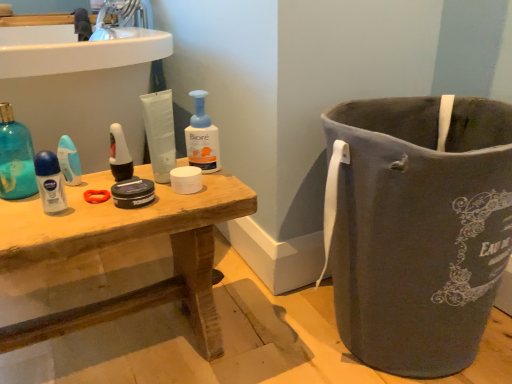
Question: Considering the relative positions of matte white shaving cream at left and translucent plastic deodorant stick at left, which ranks as the 2th cleaning product in right-to-left order, in the image provided, is matte white shaving cream at left to the left of translucent plastic deodorant stick at left, which ranks as the 2th cleaning product in right-to-left order, from the viewer's perspective?

Choices:
 (A) yes
 (B) no

Answer: (B)

Question: Is matte white shaving cream at left facing away from translucent plastic deodorant stick at left, which ranks as the 2th cleaning product in right-to-left order?

Choices:
 (A) no
 (B) yes

Answer: (A)

Question: From the image's perspective, is matte white shaving cream at left on top of translucent plastic deodorant stick at left, which ranks as the 1th cleaning product in left-to-right order?

Choices:
 (A) no
 (B) yes

Answer: (A)

Question: Is translucent plastic deodorant stick at left, which ranks as the 1th cleaning product in left-to-right order, inside matte white shaving cream at left?

Choices:
 (A) no
 (B) yes

Answer: (A)

Question: Is matte white shaving cream at left bigger than translucent plastic deodorant stick at left, which ranks as the 1th cleaning product in left-to-right order?

Choices:
 (A) yes
 (B) no

Answer: (B)

Question: Considering the relative positions of matte white shaving cream at left and translucent plastic deodorant stick at left, which ranks as the 2th cleaning product in right-to-left order, in the image provided, is matte white shaving cream at left to the right of translucent plastic deodorant stick at left, which ranks as the 2th cleaning product in right-to-left order, from the viewer's perspective?

Choices:
 (A) yes
 (B) no

Answer: (A)

Question: Considering the relative sizes of white matte toothbrush at center and translucent plastic deodorant stick at left, which ranks as the 1th cleaning product in left-to-right order, in the image provided, is white matte toothbrush at center shorter than translucent plastic deodorant stick at left, which ranks as the 1th cleaning product in left-to-right order,?

Choices:
 (A) no
 (B) yes

Answer: (B)

Question: Is white matte toothbrush at center beside translucent plastic deodorant stick at left, which ranks as the 2th cleaning product in right-to-left order?

Choices:
 (A) yes
 (B) no

Answer: (B)

Question: From a real-world perspective, is white matte toothbrush at center over translucent plastic deodorant stick at left, which ranks as the 2th cleaning product in right-to-left order?

Choices:
 (A) yes
 (B) no

Answer: (B)

Question: Can we say white matte toothbrush at center lies outside translucent plastic deodorant stick at left, which ranks as the 2th cleaning product in right-to-left order?

Choices:
 (A) no
 (B) yes

Answer: (B)

Question: Can you confirm if white matte toothbrush at center is positioned to the right of translucent plastic deodorant stick at left, which ranks as the 2th cleaning product in right-to-left order?

Choices:
 (A) yes
 (B) no

Answer: (A)

Question: Is white matte toothbrush at center at the left side of translucent plastic deodorant stick at left, which ranks as the 2th cleaning product in right-to-left order?

Choices:
 (A) yes
 (B) no

Answer: (B)

Question: Are white matte toothbrush at center and wooden table at center beside each other?

Choices:
 (A) no
 (B) yes

Answer: (A)